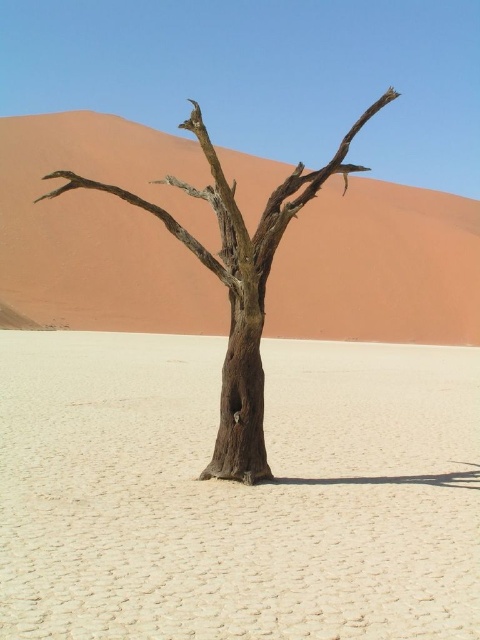
You are an explorer in the desert and see the dried mud tree at center and the brown rough tree at center. Which one is closer to you?

The dried mud tree at center is closer to you because it is in front of the brown rough tree at center.